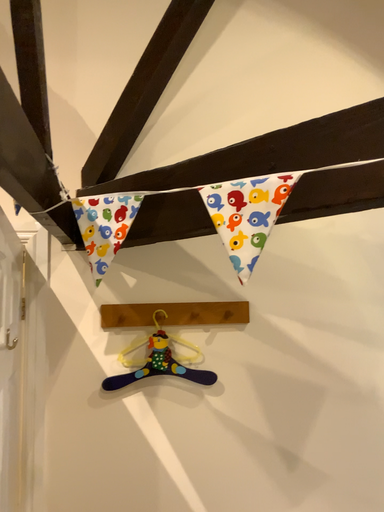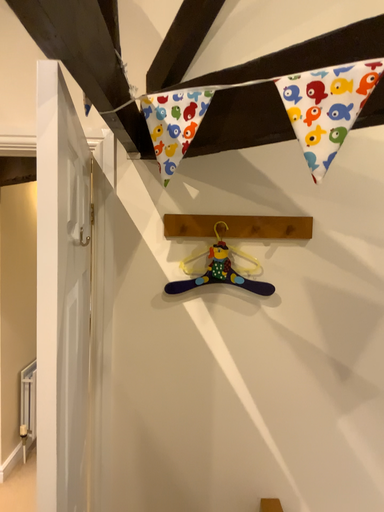
Question: Which way did the camera rotate in the video?

Choices:
 (A) rotated upward
 (B) rotated downward

Answer: (B)